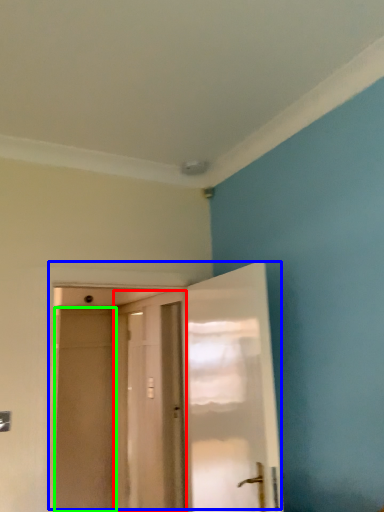
Question: Which object is positioned farthest from door (highlighted by a red box)? Select from door (highlighted by a blue box) and screen door (highlighted by a green box).

Choices:
 (A) door
 (B) screen door

Answer: (A)